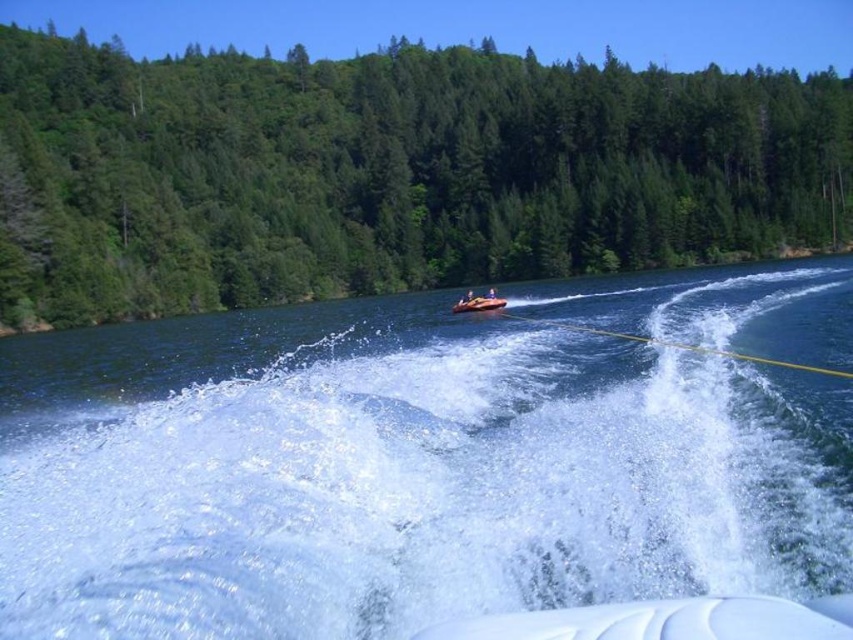
Question: Which of the following is the farthest from the observer?

Choices:
 (A) green textured trees at center
 (B) orange rubber raft at center

Answer: (A)

Question: Among these points, which one is nearest to the camera?

Choices:
 (A) (486, 307)
 (B) (376, 278)
 (C) (415, 588)

Answer: (C)

Question: Observing the image, what is the correct spatial positioning of green textured trees at center in reference to orange rubber raft at center?

Choices:
 (A) right
 (B) left

Answer: (B)

Question: Considering the real-world distances, which object is farthest from the clear water at center?

Choices:
 (A) green textured trees at center
 (B) orange rubber raft at center

Answer: (A)

Question: Does clear water at center appear on the right side of orange rubber raft at center?

Choices:
 (A) yes
 (B) no

Answer: (A)

Question: Can you confirm if clear water at center is positioned above orange rubber raft at center?

Choices:
 (A) yes
 (B) no

Answer: (B)